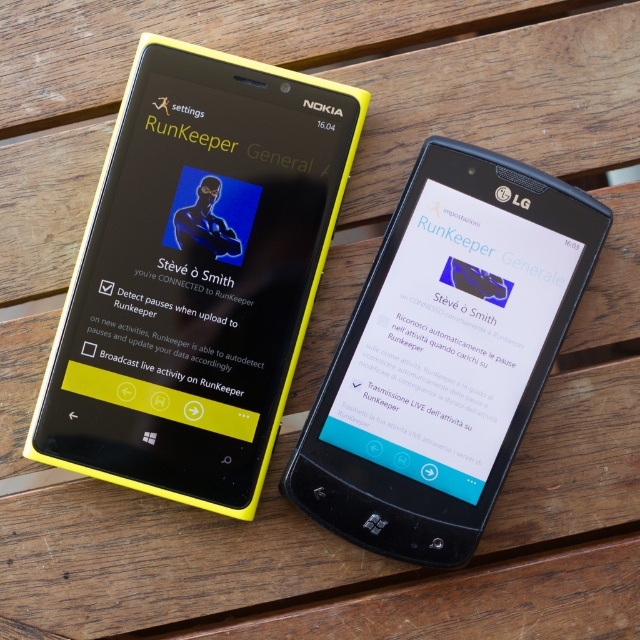
You are setting up two smartphones on a table for a tech review. The yellow plastic nokia smartphone at left and the black glossy lg smartphone at center are part of your setup. According to the spatial arrangement, which smartphone is positioned higher up on the table?

The yellow plastic nokia smartphone at left is located above the black glossy lg smartphone at center, so it is positioned higher up on the table.

You are holding a black glossy lg smartphone at center and want to place it on a table that is 1.01 meters away. Can you reach it without moving your position?

The black glossy lg smartphone at center and viewer are 1.01 meters apart from each other. Since the table is the same distance away, you can reach it if your arm length is at least 1.01 meters. However, typical human arm length is about 0.7 meters, so you might need to move closer.